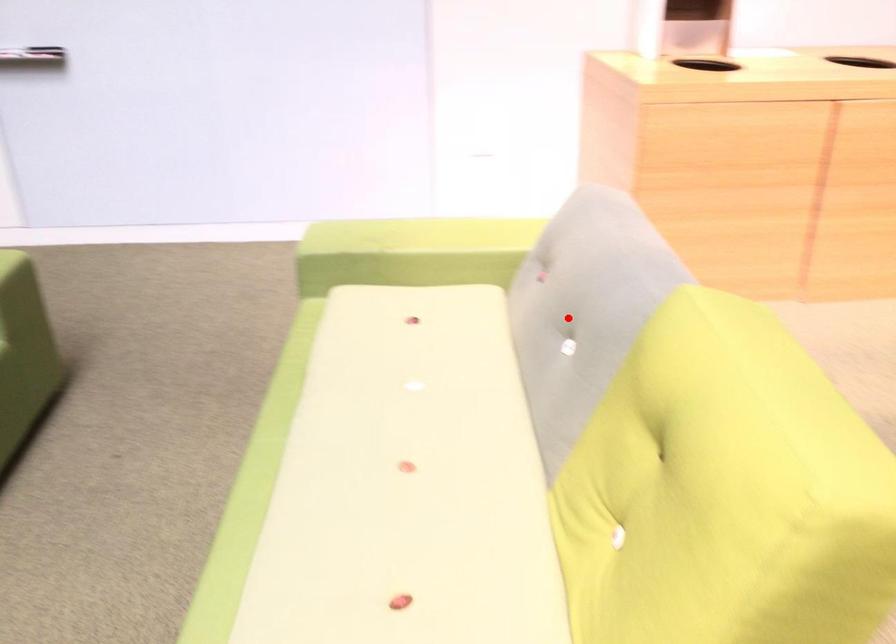
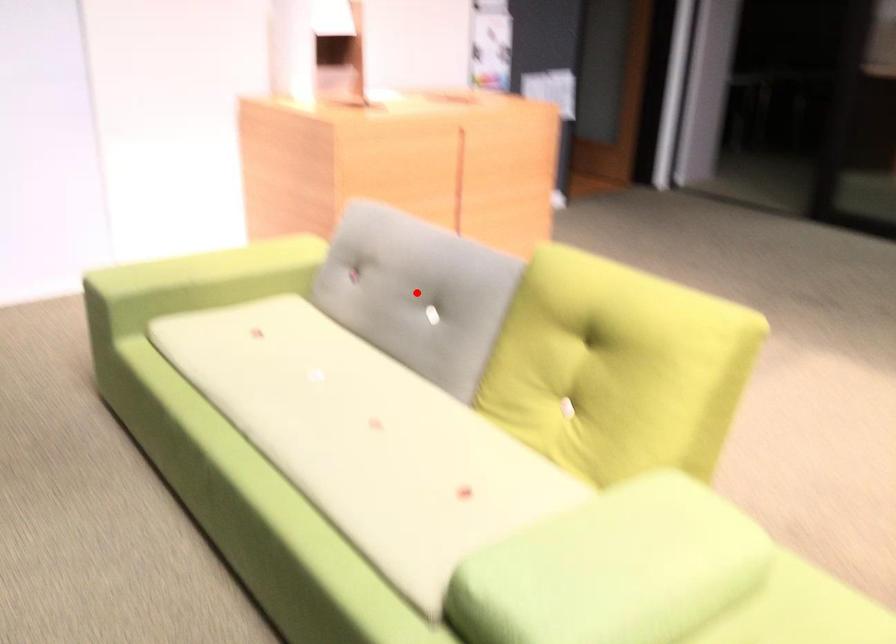
I am providing you with two images of the same scene from different viewpoints. A red point is marked on the first image and another point is marked on the second image. Do the highlighted points in image1 and image2 indicate the same real-world spot?

Yes